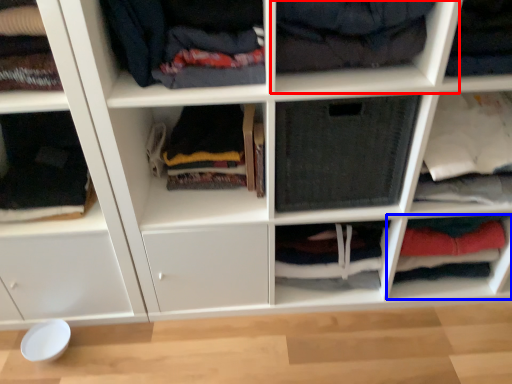
Question: Among these objects, which one is nearest to the camera, shelf (highlighted by a red box) or cabinet (highlighted by a blue box)?

Choices:
 (A) shelf
 (B) cabinet

Answer: (A)